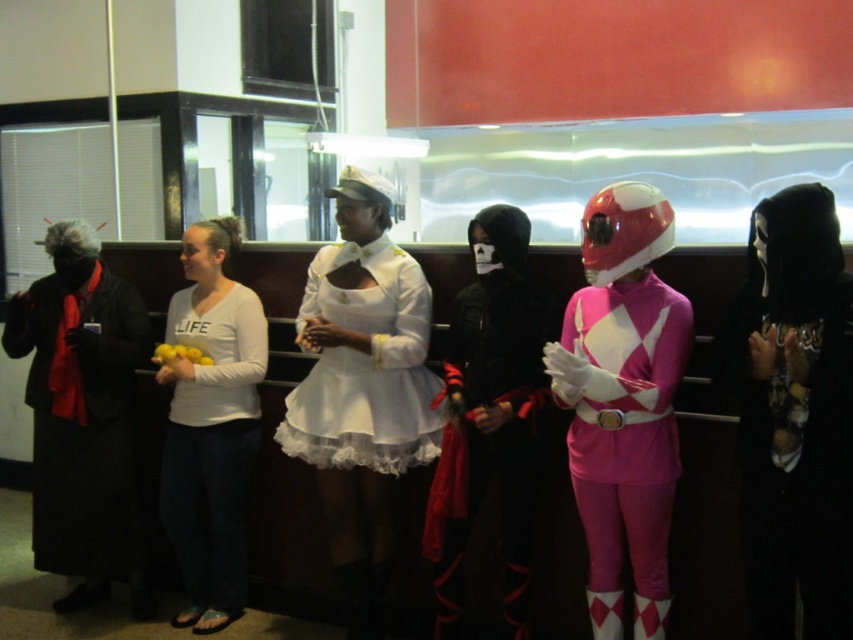
You are a photographer setting up for a group photo. You need to ensure that the white satin dress at center and the black matte coat at left are at least 1 meter apart for proper framing. Based on the scene description, can you confirm if they meet this requirement?

The white satin dress at center and the black matte coat at left are 1.01 meters apart from each other, which is just over the 1 meter requirement. Therefore, they meet the requirement for proper framing.

You are organizing a costume party and need to arrange the matte black costume at center and the white cotton shirt at center on a display rack. Which one should you place on the higher shelf to accommodate their sizes?

The matte black costume at center is larger than the white cotton shirt at center, so it should be placed on the higher shelf to accommodate its size.

You are a photographer trying to capture a photo of both the black velvet mask at center and the pink shiny power ranger suit at center. The camera you are using has a maximum focus range of 15 inches. Can you fit both objects in the frame without moving the camera?

The distance between the black velvet mask at center and the pink shiny power ranger suit at center is 15.46 inches. Since the camera can only focus up to 15 inches, the objects are slightly too far apart to be captured in the same frame without moving the camera.